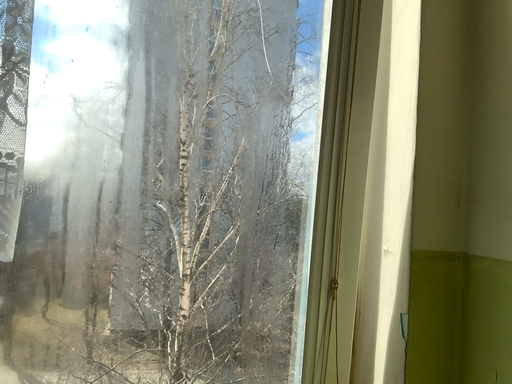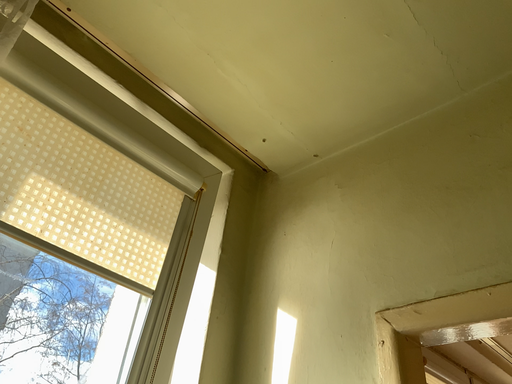
Question: Which way did the camera rotate in the video?

Choices:
 (A) rotated left
 (B) rotated right

Answer: (B)